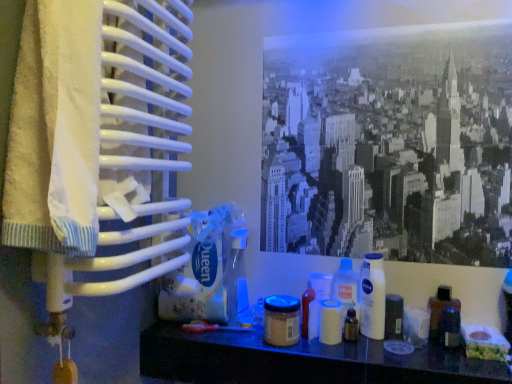
Find the location of a particular element. This screenshot has height=384, width=512. free space in front of translucent plastic bottle at center is located at coordinates (356, 347).